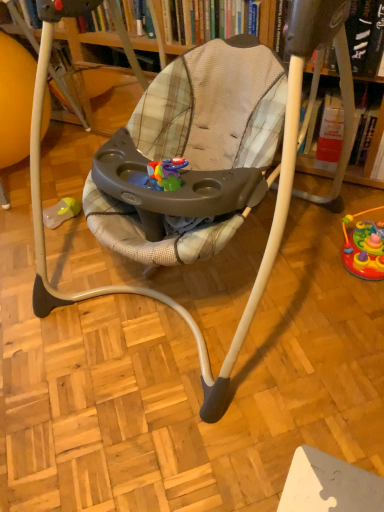
This screenshot has width=384, height=512. I want to click on free point below plaid fabric baby swing at center (from a real-world perspective), so click(x=187, y=286).